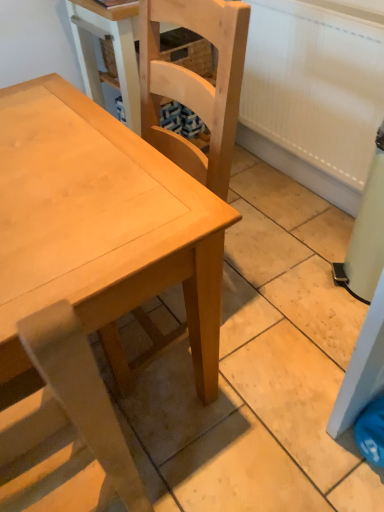
The width and height of the screenshot is (384, 512). What are the coordinates of `light wood table at center` in the screenshot? It's located at (93, 240).

Is light brown wood chair at center, which is counted as the 2th chair, starting from the top, positioned far away from light wood table at center?

No, light brown wood chair at center, which is counted as the 2th chair, starting from the top, is in close proximity to light wood table at center.

Is light brown wood chair at center, which is counted as the 2th chair, starting from the top, taller than light wood table at center?

Yes, light brown wood chair at center, which is counted as the 2th chair, starting from the top, is taller than light wood table at center.

Which is in front, point (75, 334) or point (95, 451)?

The point (75, 334) is in front.

From a real-world perspective, is light brown wood chair at center, which is the first chair in bottom-to-top order, on top of light wood table at center?

Yes.

Between point (125, 158) and point (51, 327), which one is positioned in front?

Point (51, 327)

Is light wood table at center to the right of light brown wood chair at center, which is counted as the 2th chair, starting from the top, from the viewer's perspective?

In fact, light wood table at center is to the left of light brown wood chair at center, which is counted as the 2th chair, starting from the top.

From the image's perspective, does light wood table at center appear lower than light brown wood chair at center, which is the first chair in bottom-to-top order?

No.

In the scene shown: Is light wood table at center next to light brown wood chair at center, which is the first chair in bottom-to-top order?

No, light wood table at center is not in contact with light brown wood chair at center, which is the first chair in bottom-to-top order.

Is point (193, 249) closer or farther from the camera than point (123, 388)?

Clearly, point (193, 249) is closer to the camera than point (123, 388).

Is light wood table at center spatially inside natural wood chair at center, the first chair viewed from the top, or outside of it?

light wood table at center is not inside natural wood chair at center, the first chair viewed from the top, it's outside.

Which of these two, natural wood chair at center, the first chair viewed from the top, or light wood table at center, is thinner?

natural wood chair at center, the first chair viewed from the top.

Is natural wood chair at center, which appears as the second chair when ordered from the bottom, touching light wood table at center?

No, natural wood chair at center, which appears as the second chair when ordered from the bottom, is not touching light wood table at center.

Between natural wood chair at center, which appears as the second chair when ordered from the bottom, and light wood table at center, which one is positioned behind?

natural wood chair at center, which appears as the second chair when ordered from the bottom.

Could you measure the distance between natural wood chair at center, the first chair viewed from the top, and light wood table at center?

The distance of natural wood chair at center, the first chair viewed from the top, from light wood table at center is 14.86 inches.

Measure the distance from light brown wood chair at center, which is the first chair in bottom-to-top order, to natural wood chair at center, which appears as the second chair when ordered from the bottom.

A distance of 30.53 inches exists between light brown wood chair at center, which is the first chair in bottom-to-top order, and natural wood chair at center, which appears as the second chair when ordered from the bottom.

Can you tell me how much light brown wood chair at center, which is the first chair in bottom-to-top order, and natural wood chair at center, which appears as the second chair when ordered from the bottom, differ in facing direction?

93.5 degrees separate the facing orientations of light brown wood chair at center, which is the first chair in bottom-to-top order, and natural wood chair at center, which appears as the second chair when ordered from the bottom.

Is light brown wood chair at center, which is the first chair in bottom-to-top order, shorter than natural wood chair at center, the first chair viewed from the top?

In fact, light brown wood chair at center, which is the first chair in bottom-to-top order, may be taller than natural wood chair at center, the first chair viewed from the top.

Is light brown wood chair at center, which is counted as the 2th chair, starting from the top, in contact with natural wood chair at center, the first chair viewed from the top?

light brown wood chair at center, which is counted as the 2th chair, starting from the top, and natural wood chair at center, the first chair viewed from the top, are clearly separated.

Does natural wood chair at center, which appears as the second chair when ordered from the bottom, have a lesser width compared to light brown wood chair at center, which is the first chair in bottom-to-top order?

In fact, natural wood chair at center, which appears as the second chair when ordered from the bottom, might be wider than light brown wood chair at center, which is the first chair in bottom-to-top order.

Which object is positioned more to the left, natural wood chair at center, which appears as the second chair when ordered from the bottom, or light brown wood chair at center, which is counted as the 2th chair, starting from the top?

light brown wood chair at center, which is counted as the 2th chair, starting from the top.

Which is closer to the camera, (x=108, y=358) or (x=47, y=365)?

The point (x=47, y=365) is in front.

How different are the orientations of natural wood chair at center, the first chair viewed from the top, and light brown wood chair at center, which is the first chair in bottom-to-top order, in degrees?

There is a 93.5-degree angle between the facing directions of natural wood chair at center, the first chair viewed from the top, and light brown wood chair at center, which is the first chair in bottom-to-top order.

Locate an element on the screen. This screenshot has height=512, width=384. table located underneath the light brown wood chair at center, which is counted as the 2th chair, starting from the top (from a real-world perspective) is located at coordinates (93, 240).

At what (x,y) coordinates should I click in order to perform the action: click on the 1st chair counting from the right side of the light wood table at center. Please return your answer as a coordinate pair (x, y). Image resolution: width=384 pixels, height=512 pixels. Looking at the image, I should click on (73, 400).

Considering their positions, is light wood table at center positioned closer to natural wood chair at center, which appears as the second chair when ordered from the bottom, than light brown wood chair at center, which is the first chair in bottom-to-top order?

light wood table at center.

Which object lies nearer to the anchor point light wood table at center, light brown wood chair at center, which is the first chair in bottom-to-top order, or natural wood chair at center, which appears as the second chair when ordered from the bottom?

The object closer to light wood table at center is light brown wood chair at center, which is the first chair in bottom-to-top order.

Estimate the real-world distances between objects in this image. Which object is closer to light brown wood chair at center, which is the first chair in bottom-to-top order, light wood table at center or natural wood chair at center, the first chair viewed from the top?

light wood table at center is positioned closer to the anchor light brown wood chair at center, which is the first chair in bottom-to-top order.

From the image, which object appears to be farther from natural wood chair at center, the first chair viewed from the top, light brown wood chair at center, which is the first chair in bottom-to-top order, or light wood table at center?

light brown wood chair at center, which is the first chair in bottom-to-top order.

When comparing their distances from light brown wood chair at center, which is the first chair in bottom-to-top order, does natural wood chair at center, the first chair viewed from the top, or light wood table at center seem further?

natural wood chair at center, the first chair viewed from the top, is positioned further to the anchor light brown wood chair at center, which is the first chair in bottom-to-top order.

Looking at the image, which one is located closer to light wood table at center, natural wood chair at center, the first chair viewed from the top, or light brown wood chair at center, which is counted as the 2th chair, starting from the top?

light brown wood chair at center, which is counted as the 2th chair, starting from the top.

In order to click on table that lies between natural wood chair at center, the first chair viewed from the top, and light brown wood chair at center, which is the first chair in bottom-to-top order, from top to bottom in this screenshot , I will do [x=93, y=240].